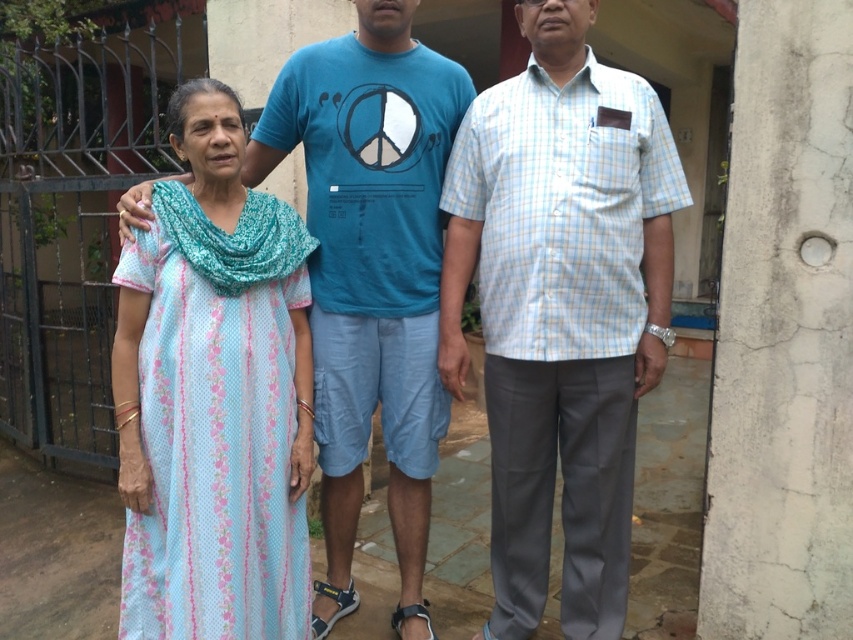
Who is shorter, light blue checkered shirt at center or light blue floral dress at left?

Standing shorter between the two is light blue floral dress at left.

Is point (543, 304) less distant than point (131, 564)?

Yes, point (543, 304) is closer to viewer.

Where is `light blue checkered shirt at center`? light blue checkered shirt at center is located at coordinates (561, 308).

Does light blue floral dress at left appear on the right side of light blue floral dress at center?

In fact, light blue floral dress at left is to the left of light blue floral dress at center.

Measure the distance between light blue floral dress at left and light blue floral dress at center.

light blue floral dress at left is 27.79 inches away from light blue floral dress at center.

Where is `light blue floral dress at left`? light blue floral dress at left is located at coordinates (213, 397).

Find the location of a particular element. The width and height of the screenshot is (853, 640). light blue floral dress at left is located at coordinates (213, 397).

In the scene shown: Who is positioned more to the left, light blue checkered shirt at center or light blue floral dress at center?

light blue floral dress at center

Does light blue checkered shirt at center have a greater height compared to light blue floral dress at center?

Incorrect, light blue checkered shirt at center's height is not larger of light blue floral dress at center's.

Does point (558, 164) lie behind point (500, 589)?

No, it is in front of (500, 589).

The height and width of the screenshot is (640, 853). I want to click on light blue checkered shirt at center, so click(561, 308).